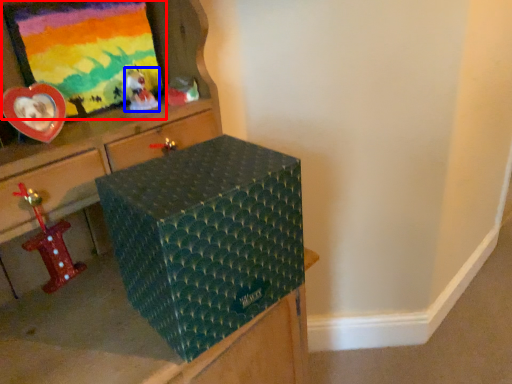
Question: Which object appears farthest to the camera in this image, picture frame (highlighted by a red box) or toy (highlighted by a blue box)?

Choices:
 (A) picture frame
 (B) toy

Answer: (B)